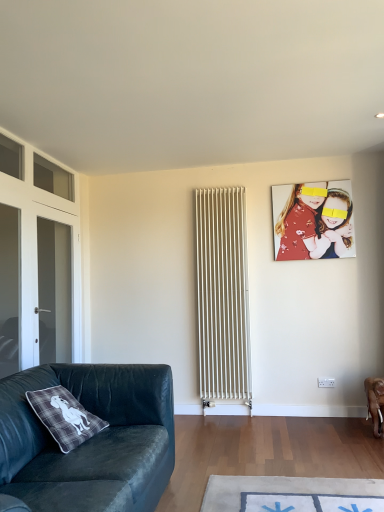
In order to click on free location above white metal radiator at center (from a real-world perspective) in this screenshot , I will do `click(218, 188)`.